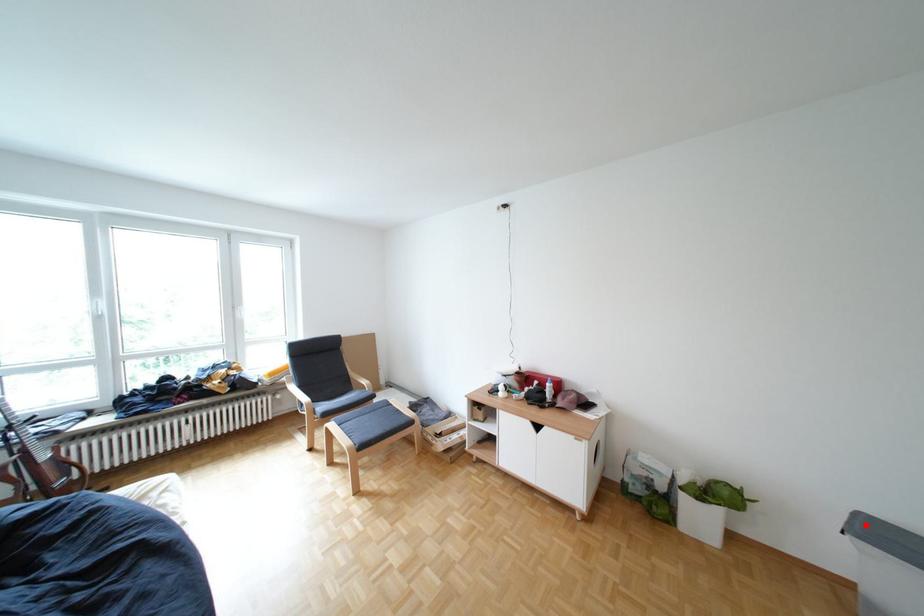
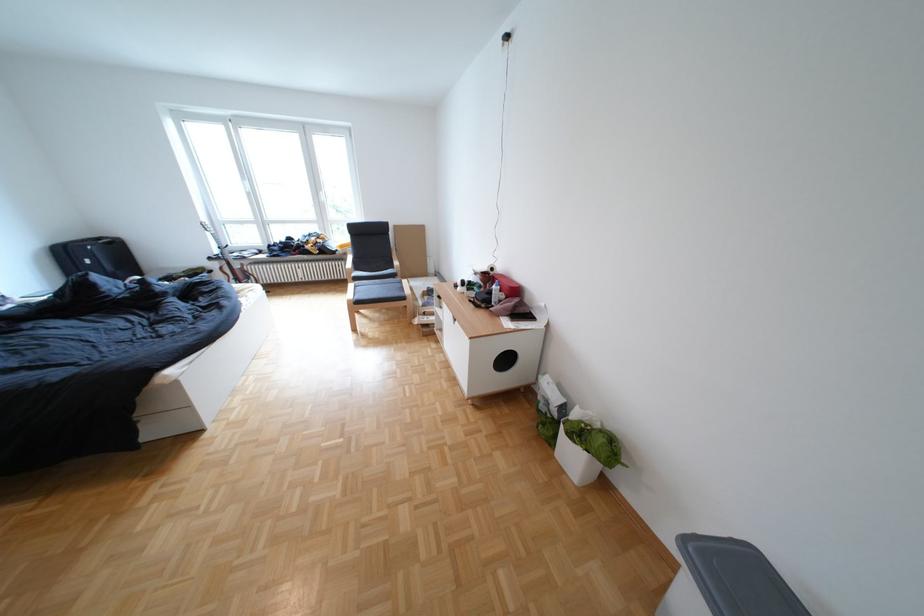
Where in the second image is the point corresponding to the highlighted location from the first image?

(712, 537)